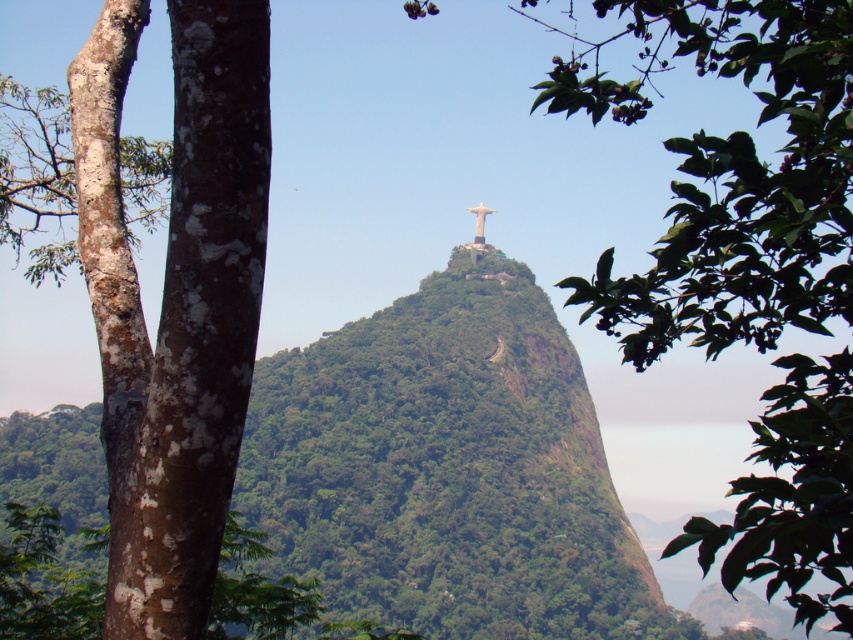
Question: Which object appears farthest from the camera in this image?

Choices:
 (A) green leafy tree at upper center
 (B) brown/scaly bark tree at left

Answer: (B)

Question: Can you confirm if green leafy tree at upper center is smaller than brown/scaly bark tree at left?

Choices:
 (A) yes
 (B) no

Answer: (B)

Question: Can you confirm if green leafy tree at upper center is positioned to the left of brown/scaly bark tree at left?

Choices:
 (A) yes
 (B) no

Answer: (B)

Question: Is green leafy tree at upper center to the left of brown/scaly bark tree at left from the viewer's perspective?

Choices:
 (A) yes
 (B) no

Answer: (B)